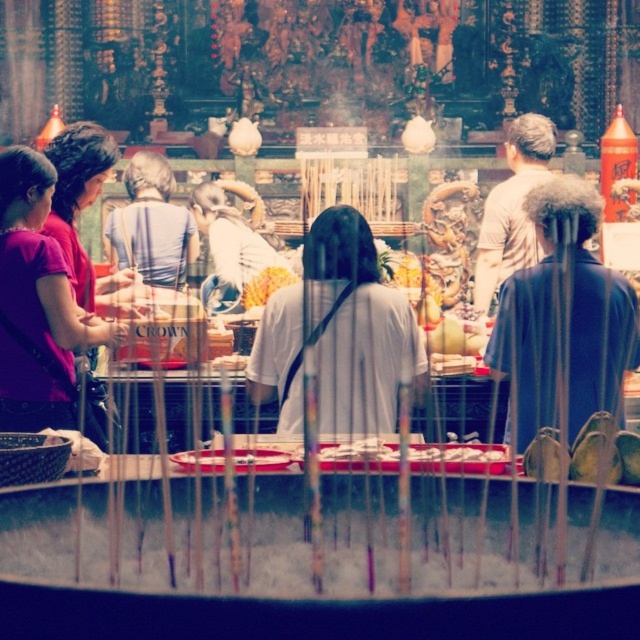
Is matte purple shirt at left smaller than yellow flower at center?

Actually, matte purple shirt at left might be larger than yellow flower at center.

The width and height of the screenshot is (640, 640). I want to click on matte purple shirt at left, so click(x=38, y=308).